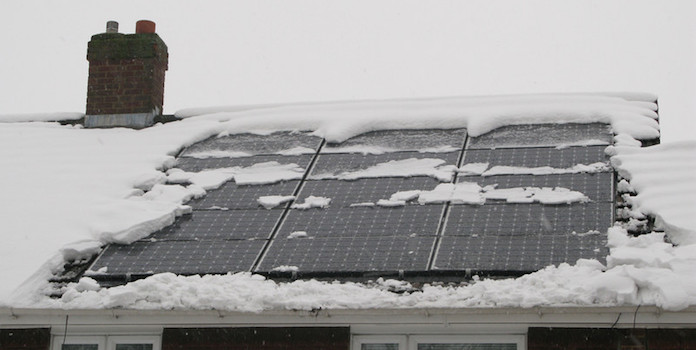
Identify the location of top of 4 windows. (466, 339), (134, 335), (387, 345), (76, 331).